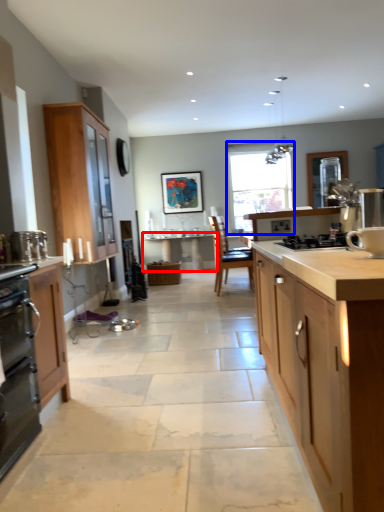
Question: Which point is further to the camera, table (highlighted by a red box) or window (highlighted by a blue box)?

Choices:
 (A) table
 (B) window

Answer: (B)